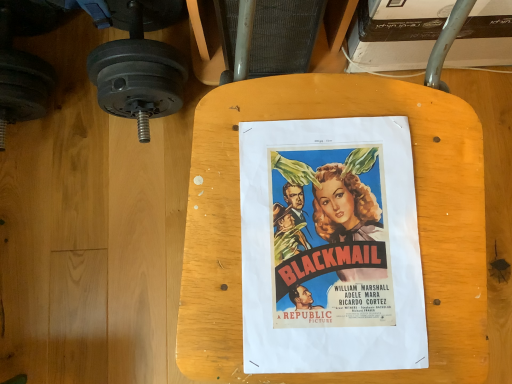
This screenshot has height=384, width=512. I want to click on free space above matte paper poster at center (from a real-world perspective), so click(333, 243).